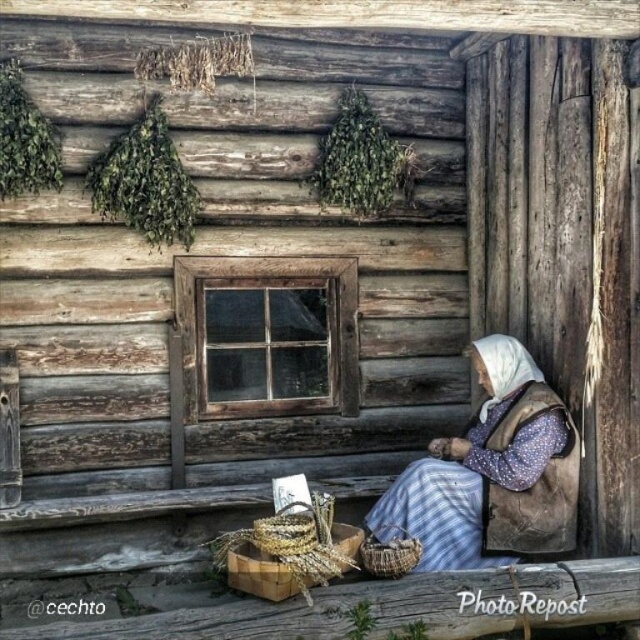
Question: Does blue plaid dress at lower right appear over woven brown basket at lower center?

Choices:
 (A) no
 (B) yes

Answer: (B)

Question: Can you confirm if blue plaid dress at lower right is positioned above woven brown basket at lower center?

Choices:
 (A) no
 (B) yes

Answer: (B)

Question: Which is farther from the blue plaid dress at lower right?

Choices:
 (A) natural woven basket at lower center
 (B) woven brown basket at lower center

Answer: (A)

Question: Which object is positioned closest to the blue plaid dress at lower right?

Choices:
 (A) natural woven basket at lower center
 (B) woven brown basket at lower center

Answer: (B)

Question: Can you confirm if blue plaid dress at lower right is wider than natural woven basket at lower center?

Choices:
 (A) no
 (B) yes

Answer: (B)

Question: Which point is closer to the camera taking this photo?

Choices:
 (A) (310, 518)
 (B) (360, 550)

Answer: (A)